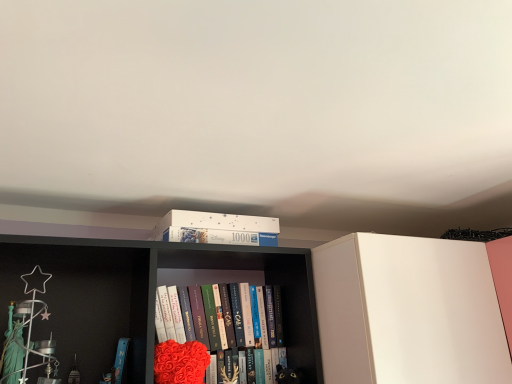
Question: From the image's perspective, would you say hardcover book at center is positioned over velvety red heart at center?

Choices:
 (A) yes
 (B) no

Answer: (A)

Question: Considering the relative sizes of hardcover book at center and velvety red heart at center in the image provided, is hardcover book at center smaller than velvety red heart at center?

Choices:
 (A) no
 (B) yes

Answer: (A)

Question: Considering the relative positions of hardcover book at center and velvety red heart at center in the image provided, is hardcover book at center in front of velvety red heart at center?

Choices:
 (A) no
 (B) yes

Answer: (A)

Question: Can you confirm if hardcover book at center is bigger than velvety red heart at center?

Choices:
 (A) no
 (B) yes

Answer: (B)

Question: Is hardcover book at center in contact with velvety red heart at center?

Choices:
 (A) no
 (B) yes

Answer: (B)

Question: Is the position of hardcover book at center more distant than that of velvety red heart at center?

Choices:
 (A) no
 (B) yes

Answer: (B)

Question: From the image's perspective, would you say velvety red heart at center is positioned over white matte puzzle box at upper center?

Choices:
 (A) yes
 (B) no

Answer: (B)

Question: Can you confirm if velvety red heart at center is smaller than white matte puzzle box at upper center?

Choices:
 (A) yes
 (B) no

Answer: (A)

Question: Is the position of velvety red heart at center less distant than that of white matte puzzle box at upper center?

Choices:
 (A) no
 (B) yes

Answer: (A)

Question: Considering the relative sizes of velvety red heart at center and white matte puzzle box at upper center in the image provided, is velvety red heart at center thinner than white matte puzzle box at upper center?

Choices:
 (A) no
 (B) yes

Answer: (B)

Question: Can you confirm if velvety red heart at center is positioned to the right of white matte puzzle box at upper center?

Choices:
 (A) no
 (B) yes

Answer: (B)

Question: Can you confirm if velvety red heart at center is wider than white matte puzzle box at upper center?

Choices:
 (A) no
 (B) yes

Answer: (A)

Question: From a real-world perspective, is white matte puzzle box at upper center on top of velvety red heart at center?

Choices:
 (A) no
 (B) yes

Answer: (B)